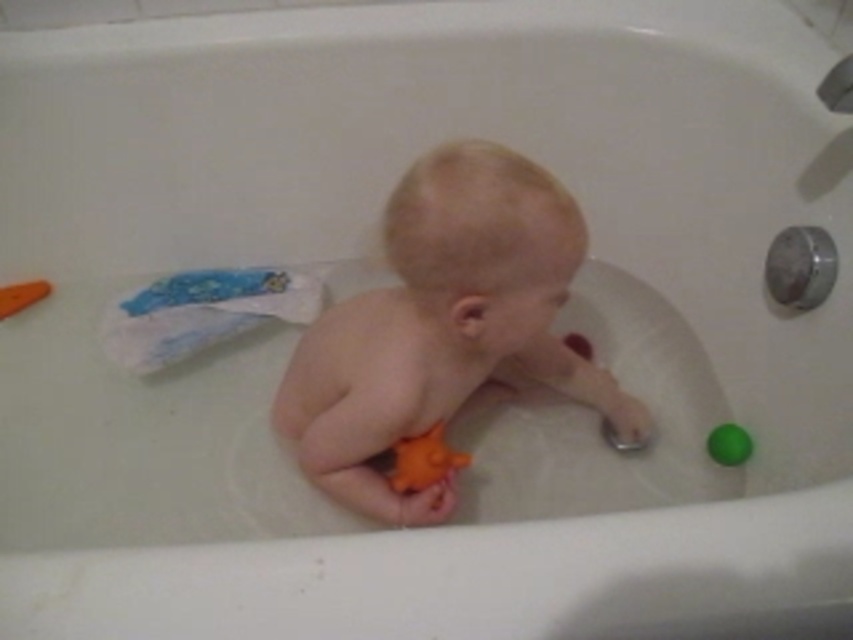
Question: Which point is farther from the camera taking this photo?

Choices:
 (A) (486, 317)
 (B) (193, 324)

Answer: (B)

Question: Among these objects, which one is farthest from the camera?

Choices:
 (A) orange rubber toy at center
 (B) orange rubber toy at left
 (C) green rubber ball at right

Answer: (B)

Question: Is white paper diaper at upper left above green rubber ball at right?

Choices:
 (A) yes
 (B) no

Answer: (A)

Question: Which object is the closest to the green rubber ball at right?

Choices:
 (A) orange rubber toy at center
 (B) orange rubber toy at left

Answer: (A)

Question: Is orange rubber toy at center thinner than orange rubber starfish at center?

Choices:
 (A) no
 (B) yes

Answer: (A)

Question: Is orange rubber toy at center bigger than orange rubber toy at left?

Choices:
 (A) no
 (B) yes

Answer: (B)